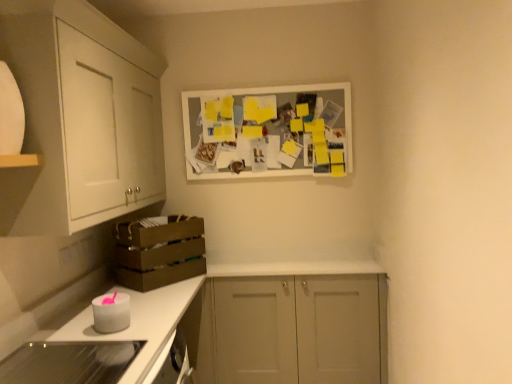
Question: From a real-world perspective, is white matte cabinet at center, which is the first cabinetry in bottom-to-top order, on white matte picture frame at upper center?

Choices:
 (A) no
 (B) yes

Answer: (A)

Question: Is white matte cabinet at center, the 2th cabinetry from the top, looking in the opposite direction of white matte picture frame at upper center?

Choices:
 (A) yes
 (B) no

Answer: (B)

Question: Considering the relative positions of white matte cabinet at center, which is the first cabinetry in bottom-to-top order, and white matte picture frame at upper center in the image provided, is white matte cabinet at center, which is the first cabinetry in bottom-to-top order, to the right of white matte picture frame at upper center from the viewer's perspective?

Choices:
 (A) yes
 (B) no

Answer: (A)

Question: Is the position of white matte cabinet at center, which is the 2th cabinetry from left to right, more distant than that of white matte picture frame at upper center?

Choices:
 (A) yes
 (B) no

Answer: (B)

Question: Can white matte picture frame at upper center be found inside white matte cabinet at center, which is counted as the first cabinetry, starting from the right?

Choices:
 (A) yes
 (B) no

Answer: (B)

Question: Is white matte cabinet at center, which is the 2th cabinetry from left to right, beside white matte picture frame at upper center?

Choices:
 (A) yes
 (B) no

Answer: (B)

Question: Is white matte candle at lower left, which is the second appliance in front-to-back order, completely or partially outside of white glossy countertop at lower left?

Choices:
 (A) yes
 (B) no

Answer: (A)

Question: Is white matte candle at lower left, which is the second appliance in front-to-back order, behind white glossy countertop at lower left?

Choices:
 (A) no
 (B) yes

Answer: (A)

Question: From a real-world perspective, is white matte candle at lower left, positioned as the second appliance in bottom-to-top order, positioned over white glossy countertop at lower left based on gravity?

Choices:
 (A) yes
 (B) no

Answer: (A)

Question: Can you confirm if white matte candle at lower left, the 1th appliance in the back-to-front sequence, is bigger than white glossy countertop at lower left?

Choices:
 (A) yes
 (B) no

Answer: (B)

Question: Does white matte candle at lower left, positioned as the second appliance in bottom-to-top order, appear on the right side of white glossy countertop at lower left?

Choices:
 (A) yes
 (B) no

Answer: (B)

Question: Are white matte candle at lower left, arranged as the 1th appliance when viewed from the top, and white glossy countertop at lower left located far from each other?

Choices:
 (A) yes
 (B) no

Answer: (B)

Question: Is white matte picture frame at upper center oriented towards glassy white stove at lower left, which ranks as the 2th appliance in top-to-bottom order?

Choices:
 (A) yes
 (B) no

Answer: (B)